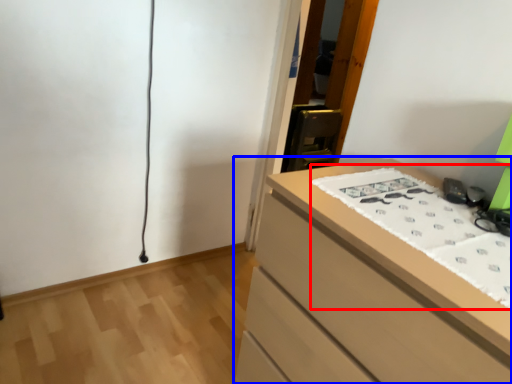
Question: Which point is further to the camera, sheet (highlighted by a red box) or chest of drawers (highlighted by a blue box)?

Choices:
 (A) sheet
 (B) chest of drawers

Answer: (A)